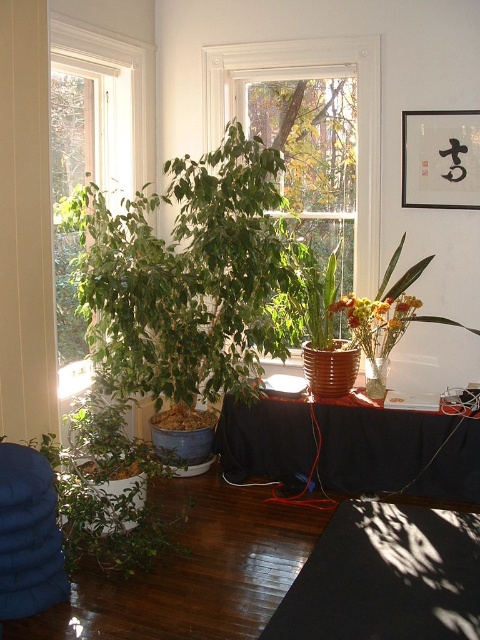
Who is positioned more to the left, white wood window at center or white frame window at left?

white frame window at left

Can you confirm if white wood window at center is bigger than white frame window at left?

Indeed, white wood window at center has a larger size compared to white frame window at left.

Where is `white wood window at center`? Image resolution: width=480 pixels, height=640 pixels. white wood window at center is located at coordinates (305, 80).

Identify the location of white wood window at center. Image resolution: width=480 pixels, height=640 pixels. (305, 80).

Is black rubber mat at lower center thinner than white wood window at center?

Correct, black rubber mat at lower center's width is less than white wood window at center's.

Does black rubber mat at lower center appear on the right side of white wood window at center?

Correct, you'll find black rubber mat at lower center to the right of white wood window at center.

Does point (335, 637) come farther from viewer compared to point (325, 45)?

No, (335, 637) is closer to viewer.

Identify the location of black rubber mat at lower center. This screenshot has height=640, width=480. (385, 577).

Can you confirm if black fabric table at center is thinner than white frame window at left?

In fact, black fabric table at center might be wider than white frame window at left.

Identify the location of black fabric table at center. (397, 452).